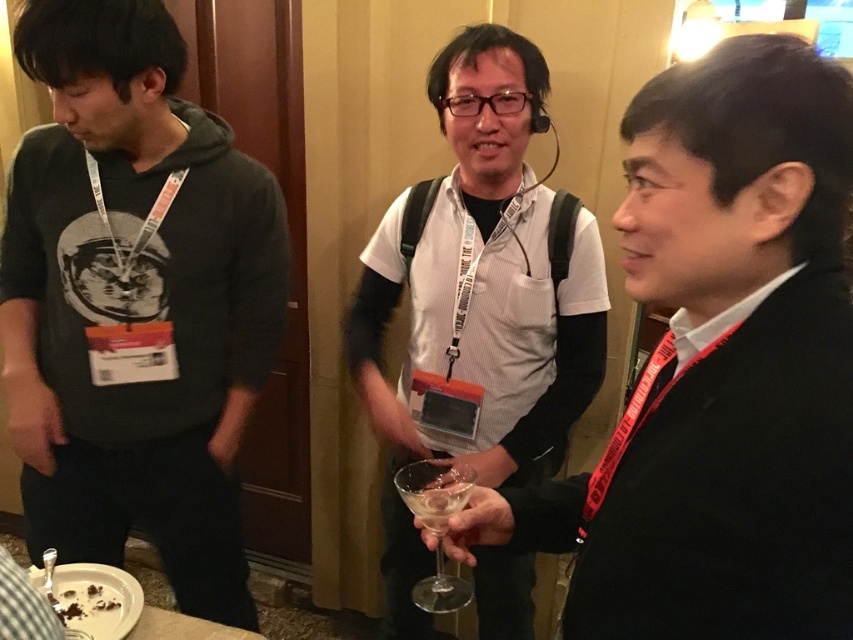
You are standing in the conference room and want to take a photo of both point (602, 524) and point (73, 358). Which point should you focus on first to ensure both are in focus?

You should focus on point (602, 524) first because it is closer to the camera than point (73, 358). This way, adjusting the focus from near to far will help both points be in focus.